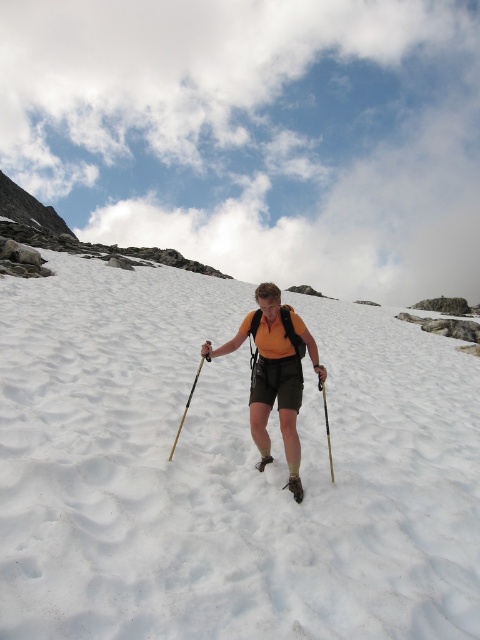
You are a hiker with a 24 inch wide backpack. You want to place your backpack between the orange fabric shorts at center and the black plastic ski pole at center. Can your backpack fit between them without overlapping either object?

The orange fabric shorts at center and black plastic ski pole at center are 24.50 inches apart from each other. Since your backpack is 24 inches wide, it can fit between them without overlapping either object as there is enough space.

You are a photographer planning to take a picture of the white powdery snow at center and the wooden ski pole at center. Based on their positions, which object should you focus on first to ensure both are in sharp focus?

The white powdery snow at center is closer to the viewer than the wooden ski pole at center, so you should focus on the white powdery snow at center first to ensure both are in sharp focus.

You are the hiker in the image and want to place a marker at the point that is closer to your current position. Which point should you choose between point (331, 577) and point (200, 369)?

Point (331, 577) is in front of point (200, 369), so you should choose point (331, 577) as it is closer to your current position.